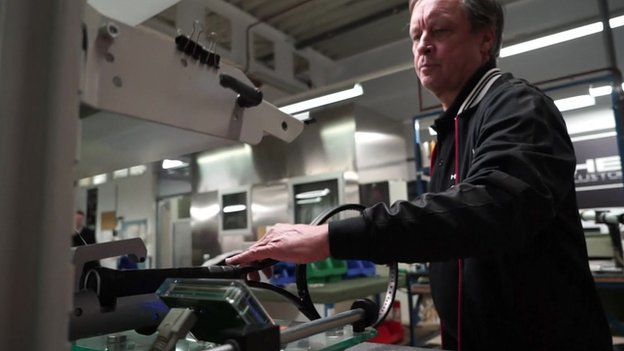
The height and width of the screenshot is (351, 624). Identify the location of back of screen. (228, 312).